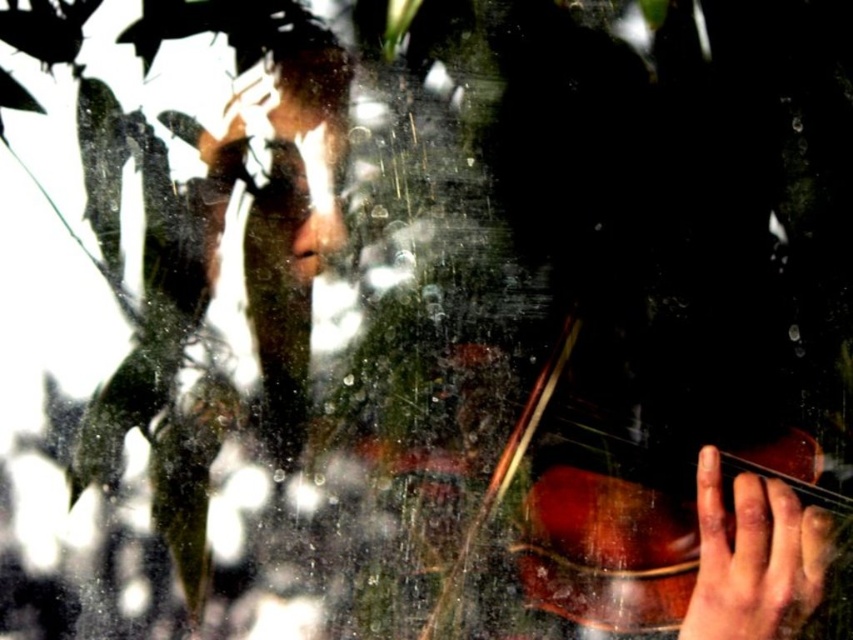
Is shiny brown violin at lower right to the left of smooth skin hand at lower right from the viewer's perspective?

Indeed, shiny brown violin at lower right is positioned on the left side of smooth skin hand at lower right.

Who is more forward, (x=471, y=520) or (x=798, y=593)?

Point (x=798, y=593) is in front.

At what (x,y) coordinates should I click in order to perform the action: click on shiny brown violin at lower right. Please return your answer as a coordinate pair (x, y). The height and width of the screenshot is (640, 853). Looking at the image, I should click on (650, 525).